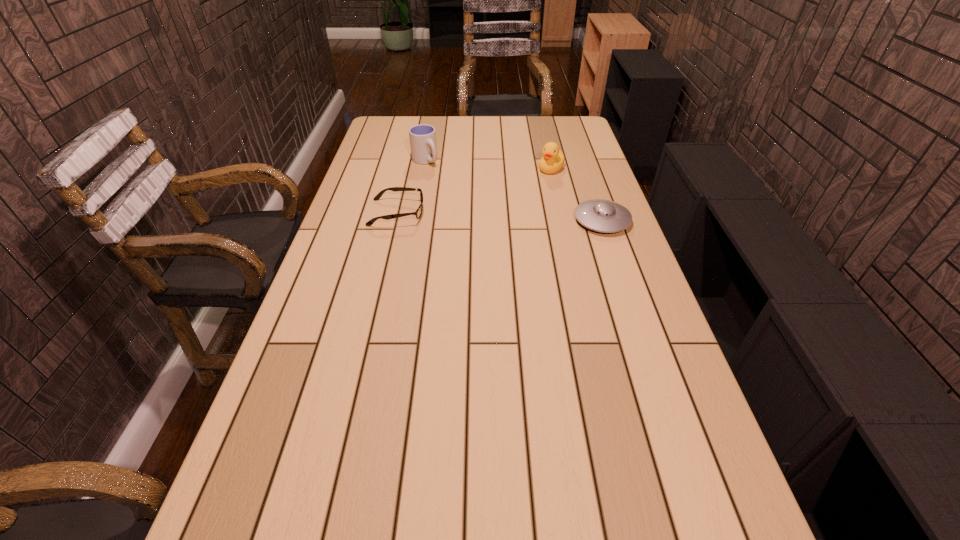
Where is `free space between the duckling and the saucer`? Image resolution: width=960 pixels, height=540 pixels. free space between the duckling and the saucer is located at coordinates (577, 194).

The height and width of the screenshot is (540, 960). I want to click on vacant space in between the cup and the saucer, so click(514, 190).

This screenshot has width=960, height=540. Find the location of `object that stands as the second closest to the duckling`. object that stands as the second closest to the duckling is located at coordinates (422, 137).

What are the coordinates of `object that is the second closest to the cup` in the screenshot? It's located at (553, 160).

At what (x,y) coordinates should I click in order to perform the action: click on free location that satisfies the following two spatial constraints: 1. on the front side of the saucer; 2. on the right side of the cup. Please return your answer as a coordinate pair (x, y). The height and width of the screenshot is (540, 960). Looking at the image, I should click on (414, 220).